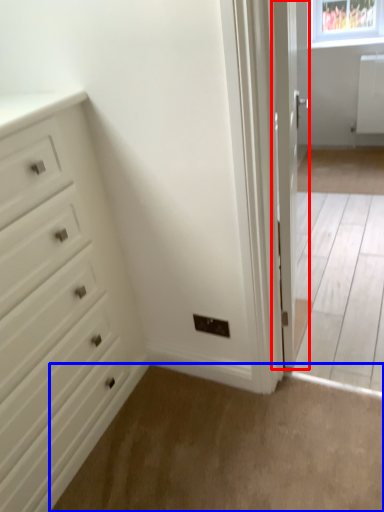
Question: Which of the following is the farthest to the observer, door (highlighted by a red box) or plain (highlighted by a blue box)?

Choices:
 (A) door
 (B) plain

Answer: (A)